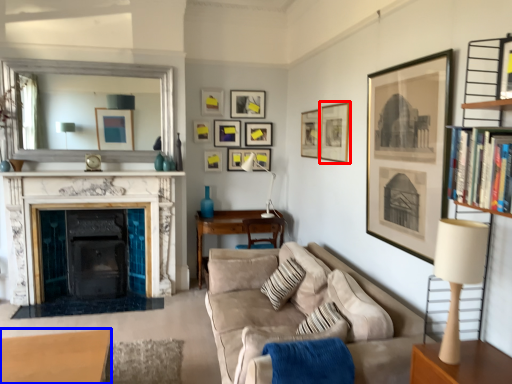
Question: Among these objects, which one is nearest to the camera, picture frame (highlighted by a red box) or table (highlighted by a blue box)?

Choices:
 (A) picture frame
 (B) table

Answer: (B)